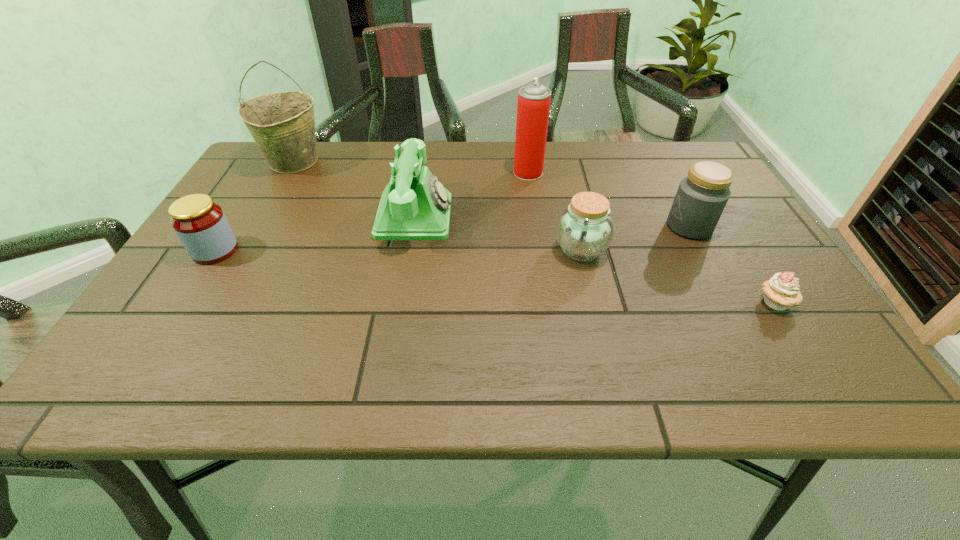
Image resolution: width=960 pixels, height=540 pixels. Find the location of `vacant region located 0.190m on the dial of the telephone`. vacant region located 0.190m on the dial of the telephone is located at coordinates (528, 217).

Identify the location of free space located 0.330m on the surface of the rightmost jar near the warning symbol. This screenshot has width=960, height=540. (530, 226).

This screenshot has height=540, width=960. I want to click on free space located 0.370m on the surface of the rightmost jar near the warning symbol, so click(514, 226).

What are the coordinates of `free space located 0.250m on the surface of the rightmost jar near the warning symbol` in the screenshot? It's located at (564, 226).

This screenshot has width=960, height=540. What are the coordinates of `vacant point located 0.250m on the back of the second jar from right to left` in the screenshot? It's located at (563, 176).

Identify the location of free location located on the front of the leftmost jar. (135, 375).

I want to click on vacant area located on the left of the cupcake, so click(x=630, y=302).

Where is `wine bucket that is at the far edge`? This screenshot has height=540, width=960. wine bucket that is at the far edge is located at coordinates (282, 124).

You are a GUI agent. You are given a task and a screenshot of the screen. Output one action in this format:
    pyautogui.click(x=<x>, y=<y>)
    Task: Click on the aerosol can positioned at the far edge
    
    Given the screenshot: What is the action you would take?
    pyautogui.click(x=533, y=107)

The width and height of the screenshot is (960, 540). Identify the location of wine bucket at the left edge. (282, 124).